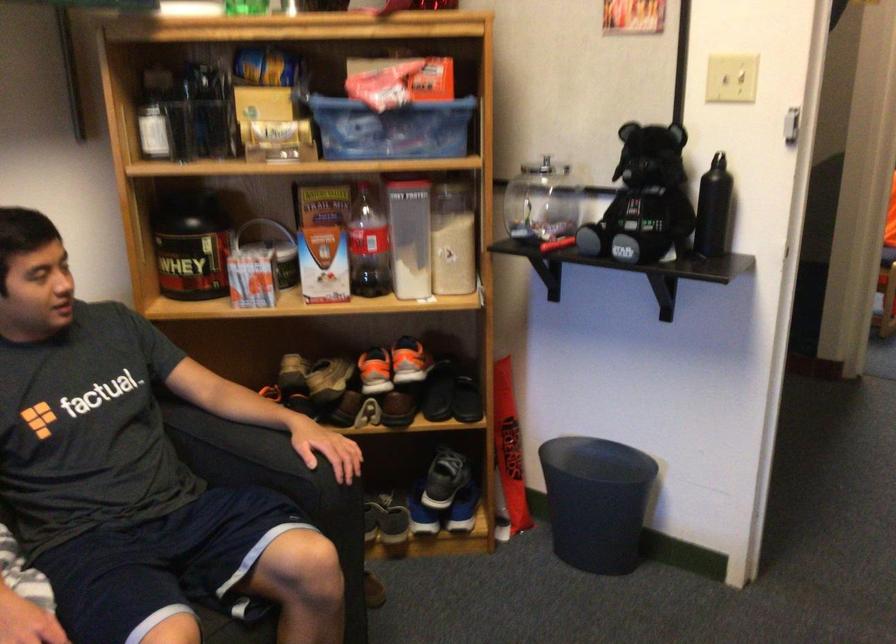
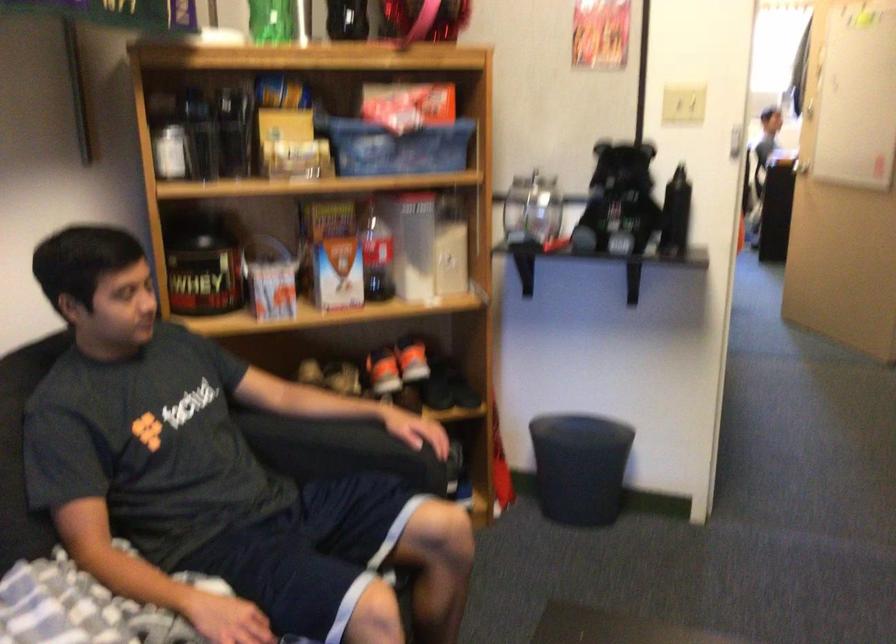
Find the pixel in the second image that matches point (401, 360) in the first image.

(411, 359)